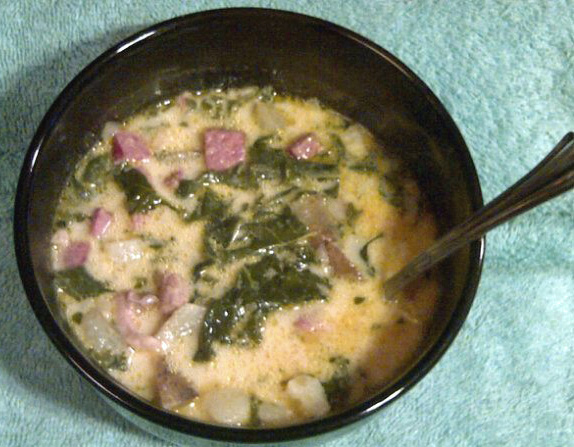
Locate an element on the screen. fabric is located at coordinates 479,80.